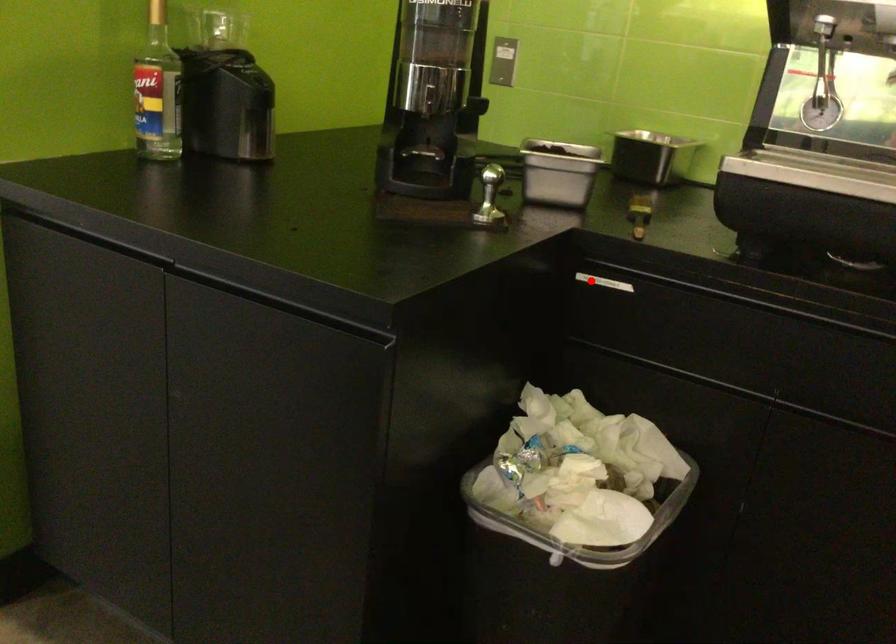
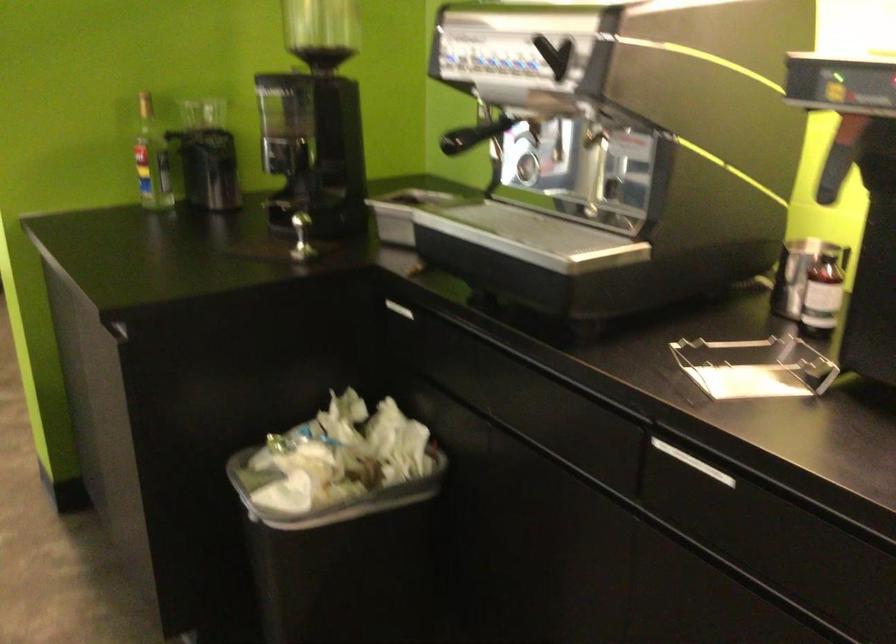
Find the pixel in the second image that matches the highlighted location in the first image.

(394, 308)